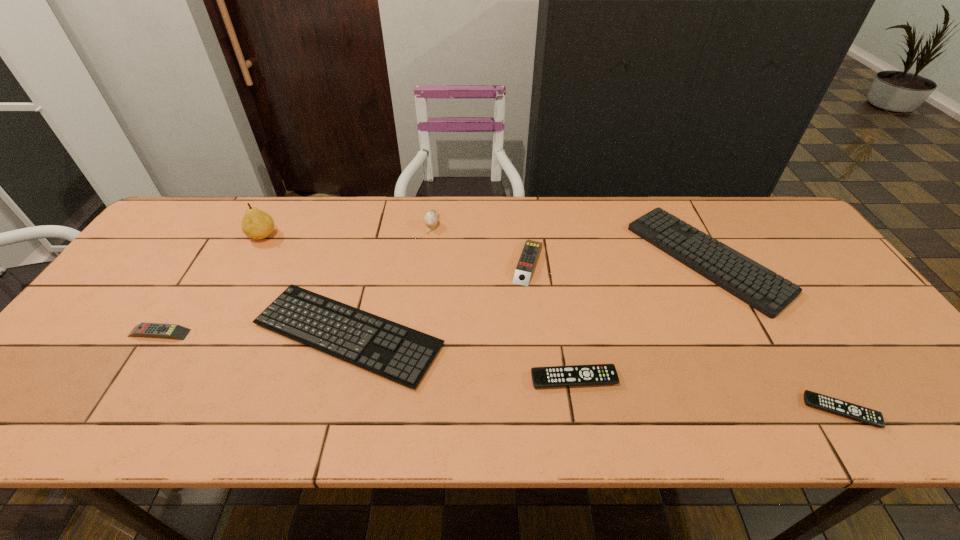
In order to click on the seventh object from right to left in this screenshot , I will do `click(256, 224)`.

I want to click on the tallest object, so click(x=256, y=224).

Image resolution: width=960 pixels, height=540 pixels. Find the location of `escargot`. escargot is located at coordinates (430, 218).

At what (x,y) coordinates should I click in order to perform the action: click on the right computer keyboard. Please return your answer as a coordinate pair (x, y). The width and height of the screenshot is (960, 540). Looking at the image, I should click on (754, 284).

At what (x,y) coordinates should I click in order to perform the action: click on the bigger yellow remote control. Please return your answer as a coordinate pair (x, y). Looking at the image, I should click on (526, 263).

The width and height of the screenshot is (960, 540). In order to click on the farthest remote control in this screenshot , I will do `click(526, 263)`.

The height and width of the screenshot is (540, 960). Find the location of `the smaller yellow remote control`. the smaller yellow remote control is located at coordinates (174, 331).

Where is `the third nearest remote control`? This screenshot has width=960, height=540. the third nearest remote control is located at coordinates (174, 331).

Image resolution: width=960 pixels, height=540 pixels. In order to click on the left computer keyboard in this screenshot , I will do `click(402, 354)`.

Image resolution: width=960 pixels, height=540 pixels. I want to click on black computer keyboard, so click(x=402, y=354).